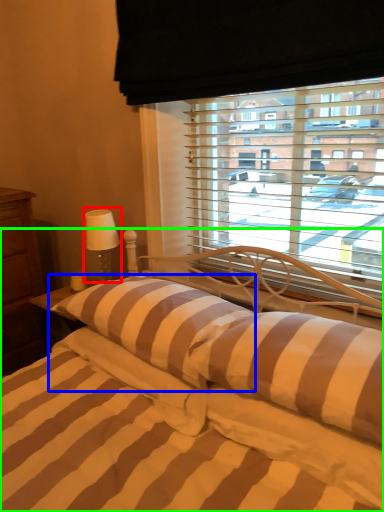
Question: Estimate the real-world distances between objects in this image. Which object is closer to table lamp (highlighted by a red box), pillow (highlighted by a blue box) or bed (highlighted by a green box)?

Choices:
 (A) pillow
 (B) bed

Answer: (A)